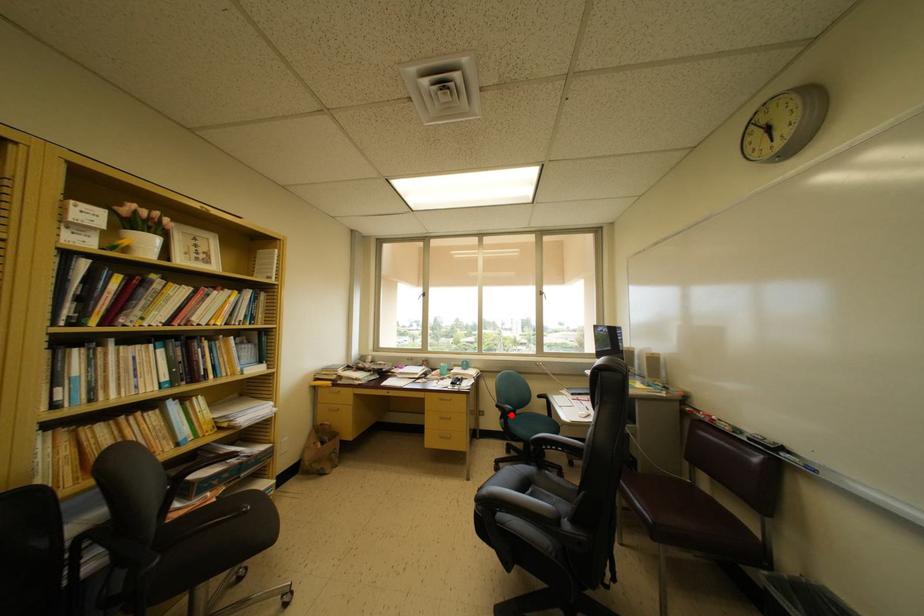
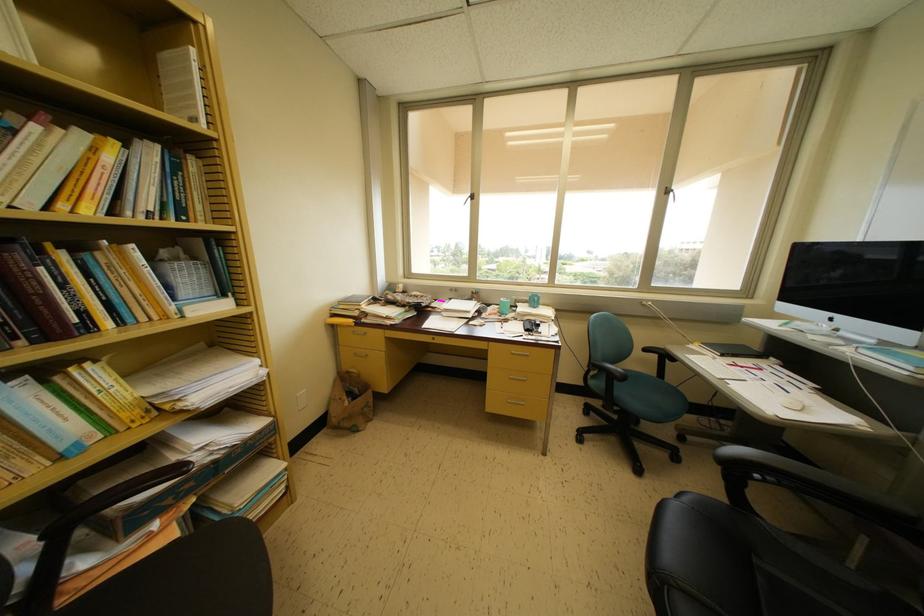
Where in the second image is the point corresponding to the highlighted location from the first image?

(622, 379)